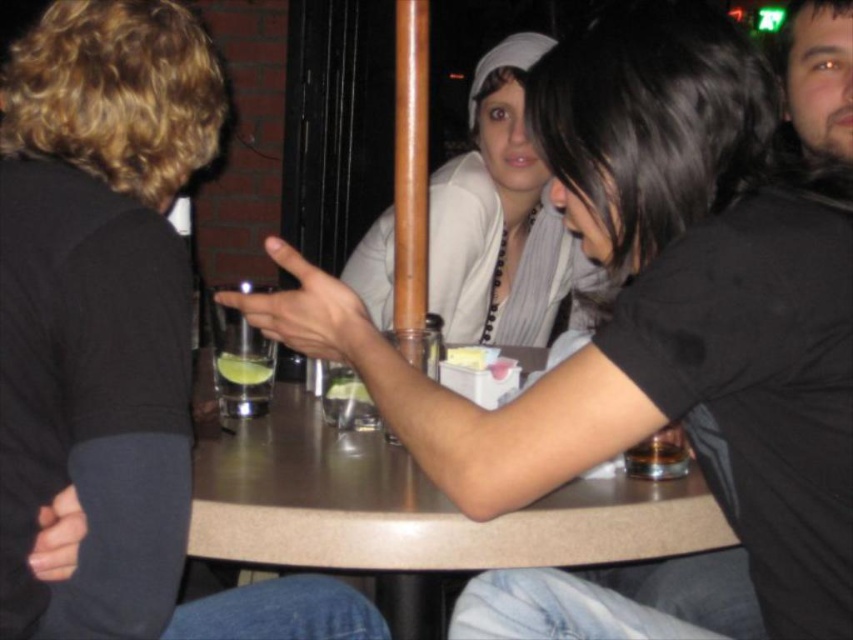
Between point (412, 449) and point (447, 340), which one is positioned in front?

Point (412, 449) is more forward.

Find the location of `black matte shirt at center`. black matte shirt at center is located at coordinates (659, 308).

Does brown laminate table at center have a lesser width compared to green translucent liquid at table center?

Incorrect, brown laminate table at center's width is not less than green translucent liquid at table center's.

Can you confirm if brown laminate table at center is positioned above green translucent liquid at table center?

Actually, brown laminate table at center is below green translucent liquid at table center.

Describe the element at coordinates (451, 518) in the screenshot. I see `brown laminate table at center` at that location.

The image size is (853, 640). What are the coordinates of `brown laminate table at center` in the screenshot? It's located at (451, 518).

Between green translucent liquid at table center and translucent glass at table center, which one appears on the right side from the viewer's perspective?

translucent glass at table center is more to the right.

Is green translucent liquid at table center to the left of translucent glass at table center from the viewer's perspective?

Yes, green translucent liquid at table center is to the left of translucent glass at table center.

Between point (229, 356) and point (625, 472), which one is positioned in front?

Point (625, 472)

Locate an element on the screen. The image size is (853, 640). green translucent liquid at table center is located at coordinates (242, 381).